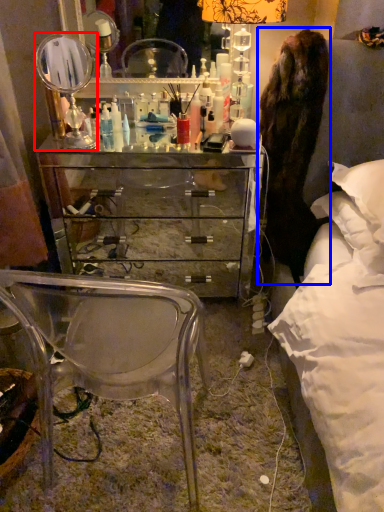
Question: Which point is further to the camera, mirror (highlighted by a red box) or fur coat (highlighted by a blue box)?

Choices:
 (A) mirror
 (B) fur coat

Answer: (A)